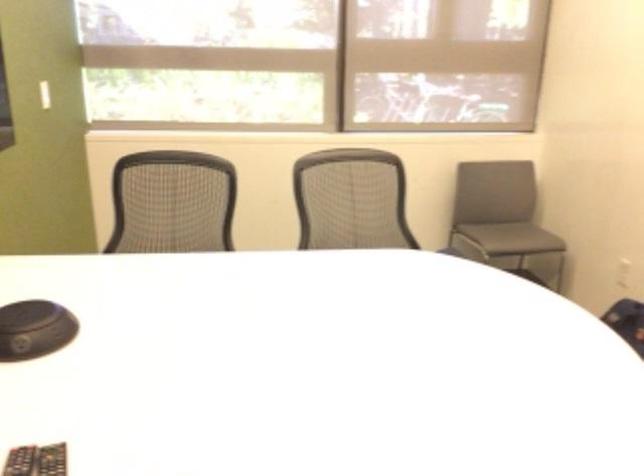
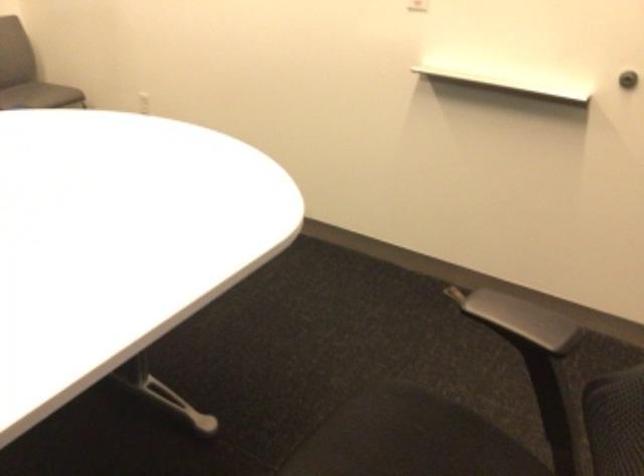
The first image is from the beginning of the video and the second image is from the end. How did the camera likely rotate when shooting the video?

The rotation direction of the camera is right-down.